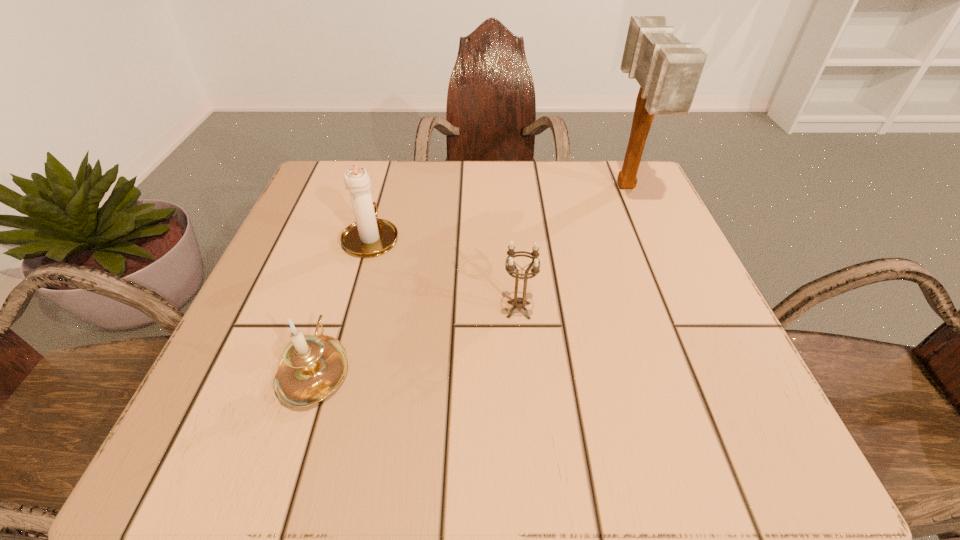
Locate an element on the screen. object that is at the near left corner is located at coordinates (312, 367).

Identify the location of object situated at the far right corner. (668, 71).

I want to click on vacant area at the far edge of the desktop, so pyautogui.click(x=557, y=172).

The width and height of the screenshot is (960, 540). In the image, there is a desktop. Identify the location of vacant space at the near edge. (358, 436).

Image resolution: width=960 pixels, height=540 pixels. Find the location of `vacant space at the left edge of the desktop`. vacant space at the left edge of the desktop is located at coordinates (331, 318).

Identify the location of free spot at the right edge of the desktop. (687, 275).

Identify the location of free spot at the near left corner of the desktop. The height and width of the screenshot is (540, 960). (259, 461).

The image size is (960, 540). What are the coordinates of `free space at the far right corner of the desktop` in the screenshot? It's located at (644, 198).

Image resolution: width=960 pixels, height=540 pixels. I want to click on empty space that is in between the tallest object and the tallest candle holder, so click(499, 213).

This screenshot has width=960, height=540. In order to click on vacant space that's between the tallest object and the third shortest object in this screenshot , I will do `click(499, 213)`.